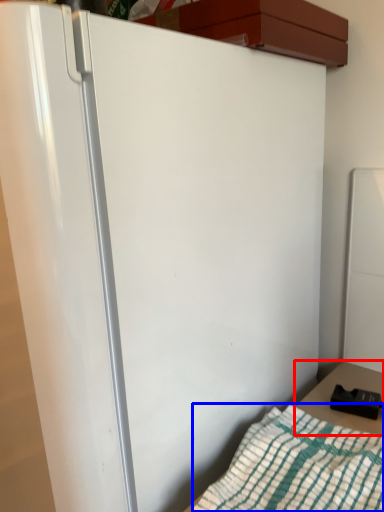
Question: Which object is closer to the camera taking this photo, table (highlighted by a red box) or blanket (highlighted by a blue box)?

Choices:
 (A) table
 (B) blanket

Answer: (B)